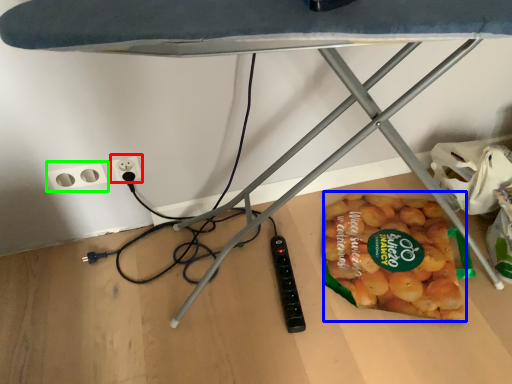
Question: Which object is positioned closest to electric outlet (highlighted by a red box)? Select from snack (highlighted by a blue box) and socket (highlighted by a green box).

Choices:
 (A) snack
 (B) socket

Answer: (B)